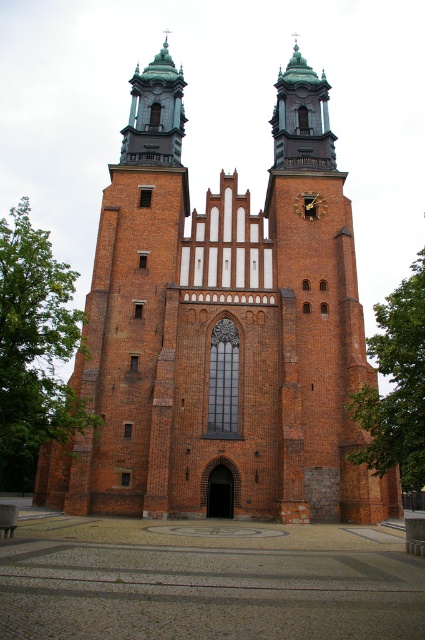
You are standing in front of the historic church and notice two points marked on the facade. The first point is at coordinates point (356, 513) and the second at point (314, 198). From your perspective, which point appears closer to you?

Point (356, 513) is in front of point (314, 198), so it appears closer to you.

You are a drone operator trying to capture aerial footage of the brick church at center. Your drone is currently hovering at point (221, 332). What structure will the drone be directly above?

The point (221, 332) corresponds to the brick church at center, so the drone will be directly above the brick church at center.